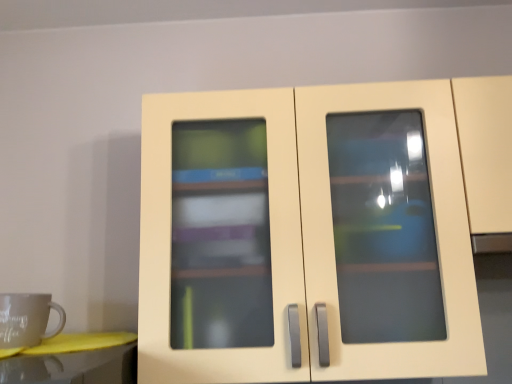
Question: Does matte cream cupboard at center have a greater height compared to matte gray mug at left?

Choices:
 (A) yes
 (B) no

Answer: (A)

Question: Is the depth of matte cream cupboard at center greater than that of matte gray mug at left?

Choices:
 (A) no
 (B) yes

Answer: (A)

Question: Considering the relative sizes of matte cream cupboard at center and matte gray mug at left in the image provided, is matte cream cupboard at center thinner than matte gray mug at left?

Choices:
 (A) yes
 (B) no

Answer: (B)

Question: Does matte cream cupboard at center appear on the left side of matte gray mug at left?

Choices:
 (A) no
 (B) yes

Answer: (A)

Question: Is matte cream cupboard at center bigger than matte gray mug at left?

Choices:
 (A) no
 (B) yes

Answer: (B)

Question: Is matte cream cupboard at center outside matte gray mug at left?

Choices:
 (A) no
 (B) yes

Answer: (B)

Question: Is matte gray mug at left far from matte cream cupboard at center?

Choices:
 (A) no
 (B) yes

Answer: (A)

Question: Considering the relative sizes of matte gray mug at left and matte cream cupboard at center in the image provided, is matte gray mug at left wider than matte cream cupboard at center?

Choices:
 (A) yes
 (B) no

Answer: (B)

Question: Is matte gray mug at left aimed at matte cream cupboard at center?

Choices:
 (A) no
 (B) yes

Answer: (A)

Question: Is matte gray mug at left completely or partially outside of matte cream cupboard at center?

Choices:
 (A) no
 (B) yes

Answer: (B)

Question: Considering the relative sizes of matte gray mug at left and matte cream cupboard at center in the image provided, is matte gray mug at left shorter than matte cream cupboard at center?

Choices:
 (A) no
 (B) yes

Answer: (B)

Question: Is matte gray mug at left positioned in front of matte cream cupboard at center?

Choices:
 (A) no
 (B) yes

Answer: (A)

Question: From a real-world perspective, relative to matte gray mug at left, is matte cream cupboard at center vertically above or below?

Choices:
 (A) above
 (B) below

Answer: (A)